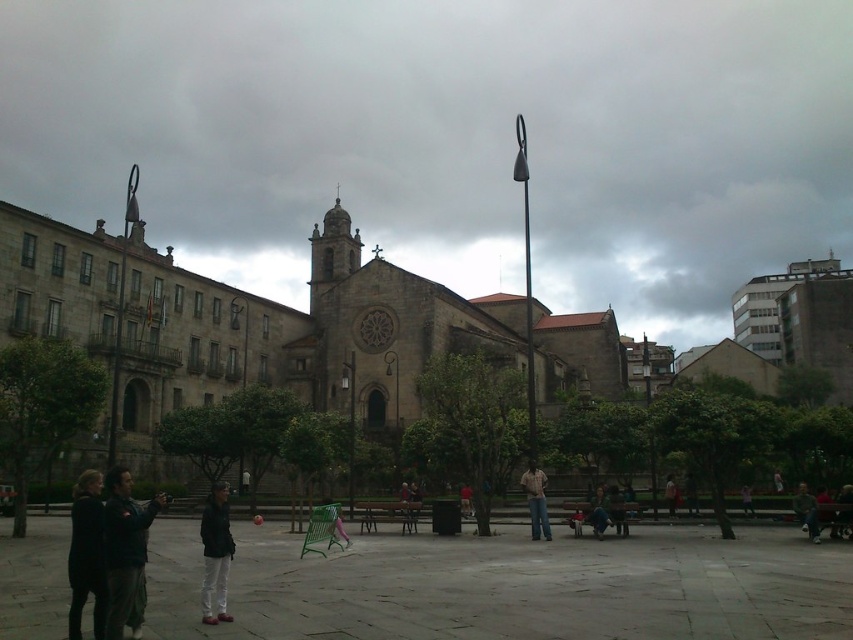
Between matte stone building at center and dark green jacket at lower left, which one has more height?

matte stone building at center

Is point (469, 68) positioned in front of point (122, 532)?

No, (469, 68) is further to viewer.

Which is in front, point (566, 138) or point (109, 532)?

Point (109, 532) is more forward.

Locate an element on the screen. matte stone building at center is located at coordinates (450, 138).

What do you see at coordinates (86, 554) in the screenshot? The width and height of the screenshot is (853, 640). I see `dark gray jacket at lower left` at bounding box center [86, 554].

Is dark gray jacket at lower left smaller than dark gray jacket at center?

No, dark gray jacket at lower left is not smaller than dark gray jacket at center.

Is point (74, 492) farther from viewer compared to point (215, 566)?

That is True.

Where is `dark gray jacket at lower left`? This screenshot has height=640, width=853. dark gray jacket at lower left is located at coordinates (86, 554).

The height and width of the screenshot is (640, 853). Describe the element at coordinates (537, 500) in the screenshot. I see `brown cotton shirt at center` at that location.

Which is more to the right, brown cotton shirt at center or red fabric jacket at center?

red fabric jacket at center is more to the right.

Between point (527, 467) and point (670, 506), which one is positioned in front?

Point (670, 506) is more forward.

The image size is (853, 640). Find the location of `brown cotton shirt at center`. brown cotton shirt at center is located at coordinates (537, 500).